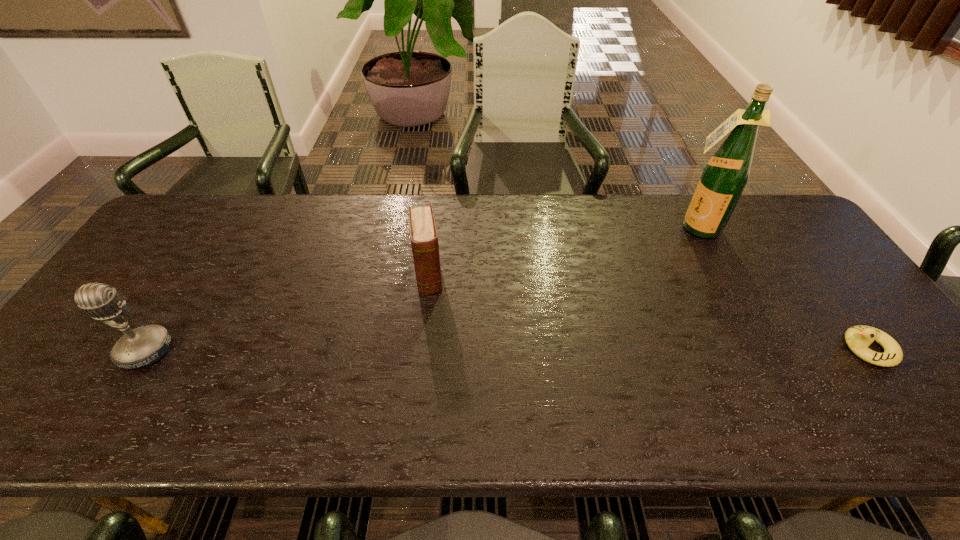
Where is `the leftmost object`? This screenshot has width=960, height=540. the leftmost object is located at coordinates (143, 346).

The height and width of the screenshot is (540, 960). I want to click on microphone, so click(x=143, y=346).

Where is `the rightmost object`? the rightmost object is located at coordinates point(858,338).

You are a GUI agent. You are given a task and a screenshot of the screen. Output one action in this format:
    pyautogui.click(x=<x>, y=<y>)
    Task: Click on the shortest object
    The width and height of the screenshot is (960, 540).
    Given the screenshot: What is the action you would take?
    pyautogui.click(x=858, y=338)

The image size is (960, 540). Find the location of `liquor`. liquor is located at coordinates (725, 176).

This screenshot has width=960, height=540. What are the coordinates of `the tallest object` in the screenshot? It's located at (725, 176).

The image size is (960, 540). Find the location of `the third nearest object`. the third nearest object is located at coordinates (424, 240).

Locate an element on the screen. diary is located at coordinates (424, 240).

Where is `free space located on the face of the rightmost object`? This screenshot has width=960, height=540. free space located on the face of the rightmost object is located at coordinates (762, 349).

You are a GUI agent. You are given a task and a screenshot of the screen. Output one action in this format:
    pyautogui.click(x=<x>, y=<y>)
    Task: Click on the free space located on the face of the rightmost object
    This screenshot has height=540, width=960.
    Given the screenshot: What is the action you would take?
    pyautogui.click(x=679, y=349)